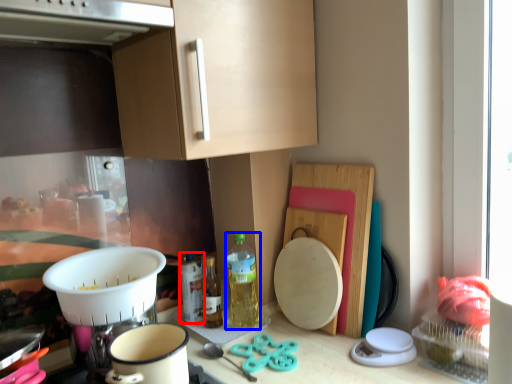
Question: Which object is further to the camera taking this photo, bottle (highlighted by a red box) or bottle (highlighted by a blue box)?

Choices:
 (A) bottle
 (B) bottle

Answer: (A)